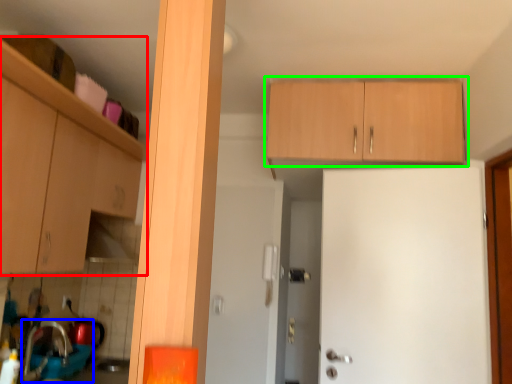
Question: Which is nearer to the cabinetry (highlighted by a red box)? sink (highlighted by a blue box) or cabinetry (highlighted by a green box).

Choices:
 (A) sink
 (B) cabinetry

Answer: (A)